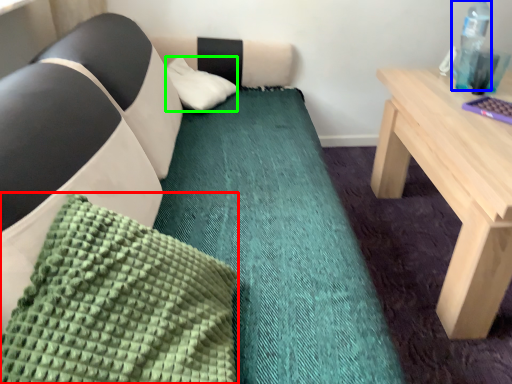
Question: Which is nearer to the pillow (highlighted by a red box)? bottle (highlighted by a blue box) or pillow (highlighted by a green box).

Choices:
 (A) bottle
 (B) pillow

Answer: (B)